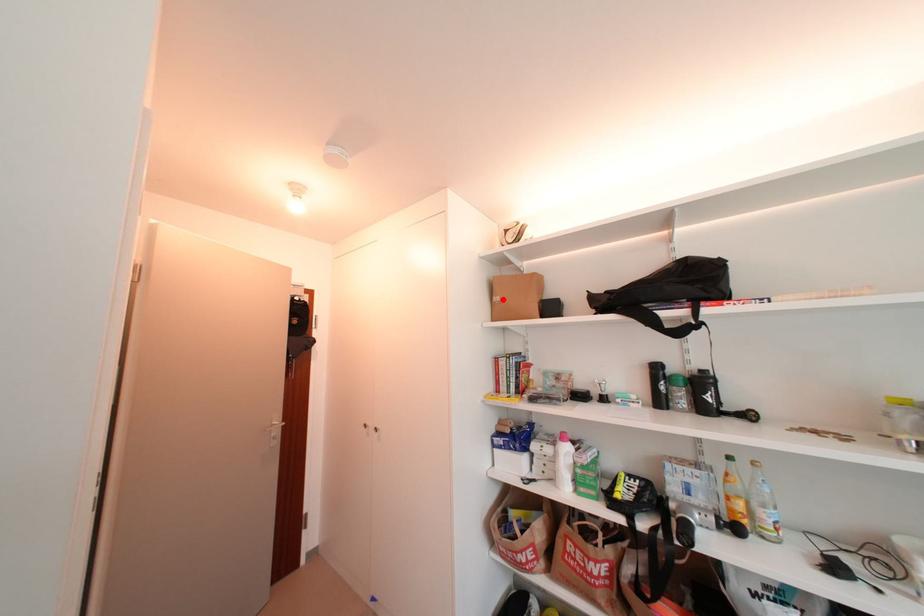
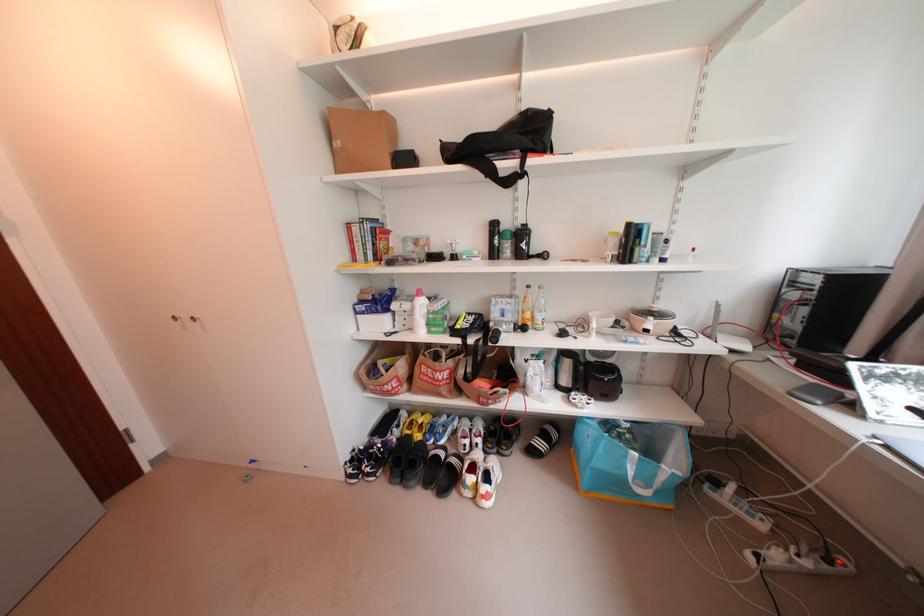
Find the pixel in the second image that matches the highlighted location in the first image.

(343, 145)